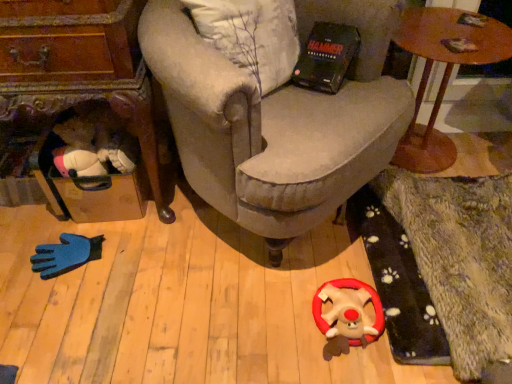
Question: Does velvet beige armchair at center have a greater width compared to wooden suitcase at left, marked as the 2th table in a right-to-left arrangement?

Choices:
 (A) no
 (B) yes

Answer: (B)

Question: Is velvet beige armchair at center taller than wooden suitcase at left, marked as the 2th table in a right-to-left arrangement?

Choices:
 (A) yes
 (B) no

Answer: (A)

Question: From the image's perspective, is velvet beige armchair at center above wooden suitcase at left, marked as the 2th table in a right-to-left arrangement?

Choices:
 (A) no
 (B) yes

Answer: (B)

Question: Considering the relative sizes of velvet beige armchair at center and wooden suitcase at left, arranged as the 1th table when viewed from the left, in the image provided, is velvet beige armchair at center shorter than wooden suitcase at left, arranged as the 1th table when viewed from the left,?

Choices:
 (A) no
 (B) yes

Answer: (A)

Question: From the image's perspective, is velvet beige armchair at center located beneath wooden suitcase at left, marked as the 2th table in a right-to-left arrangement?

Choices:
 (A) yes
 (B) no

Answer: (B)

Question: Is velvet beige armchair at center completely or partially outside of wooden suitcase at left, arranged as the 1th table when viewed from the left?

Choices:
 (A) no
 (B) yes

Answer: (B)

Question: Does wooden suitcase at left, marked as the 2th table in a right-to-left arrangement, have a greater height compared to wooden round table at upper right, which is counted as the 2th table, starting from the left?

Choices:
 (A) yes
 (B) no

Answer: (B)

Question: From the image's perspective, would you say wooden suitcase at left, marked as the 2th table in a right-to-left arrangement, is positioned over wooden round table at upper right, which is counted as the 2th table, starting from the left?

Choices:
 (A) yes
 (B) no

Answer: (B)

Question: Is wooden suitcase at left, marked as the 2th table in a right-to-left arrangement, behind wooden round table at upper right, which is counted as the 2th table, starting from the left?

Choices:
 (A) yes
 (B) no

Answer: (B)

Question: Does wooden suitcase at left, marked as the 2th table in a right-to-left arrangement, have a larger size compared to wooden round table at upper right, the first table in the right-to-left sequence?

Choices:
 (A) no
 (B) yes

Answer: (A)

Question: Is wooden suitcase at left, arranged as the 1th table when viewed from the left, positioned with its back to wooden round table at upper right, the first table in the right-to-left sequence?

Choices:
 (A) yes
 (B) no

Answer: (B)

Question: Considering the relative sizes of wooden suitcase at left, arranged as the 1th table when viewed from the left, and wooden round table at upper right, which is counted as the 2th table, starting from the left, in the image provided, is wooden suitcase at left, arranged as the 1th table when viewed from the left, smaller than wooden round table at upper right, which is counted as the 2th table, starting from the left,?

Choices:
 (A) no
 (B) yes

Answer: (B)

Question: From a real-world perspective, is wooden round table at upper right, the first table in the right-to-left sequence, positioned under fluffy plush toy at center based on gravity?

Choices:
 (A) yes
 (B) no

Answer: (B)